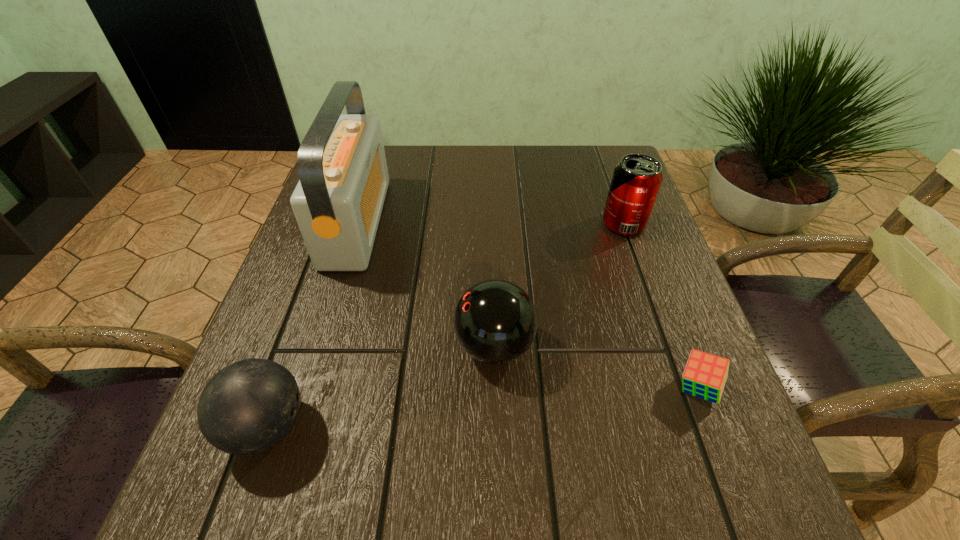
I want to click on object present at the near left corner, so click(x=249, y=406).

Locate an element on the screen. Image resolution: width=960 pixels, height=540 pixels. vacant space at the far edge is located at coordinates (529, 152).

In the image, there is a desktop. Where is `free space at the left edge`? The image size is (960, 540). free space at the left edge is located at coordinates (336, 297).

Locate an element on the screen. The image size is (960, 540). vacant space at the right edge of the desktop is located at coordinates click(602, 240).

At what (x,y) coordinates should I click in order to perform the action: click on vacant space at the far left corner of the desktop. Please return your answer as a coordinate pair (x, y). Looking at the image, I should click on (385, 154).

In order to click on vacant space at the near left corner of the desktop in this screenshot , I will do `click(225, 518)`.

The width and height of the screenshot is (960, 540). What are the coordinates of `vacant space at the far right corner of the desktop` in the screenshot? It's located at (610, 158).

Where is `free space between the soda can and the nearer bowling ball`? free space between the soda can and the nearer bowling ball is located at coordinates (445, 326).

Image resolution: width=960 pixels, height=540 pixels. In order to click on free spot between the nearer bowling ball and the third object from left to right in this screenshot , I will do `click(381, 387)`.

This screenshot has width=960, height=540. In order to click on free point between the soda can and the farther bowling ball in this screenshot , I will do `click(559, 285)`.